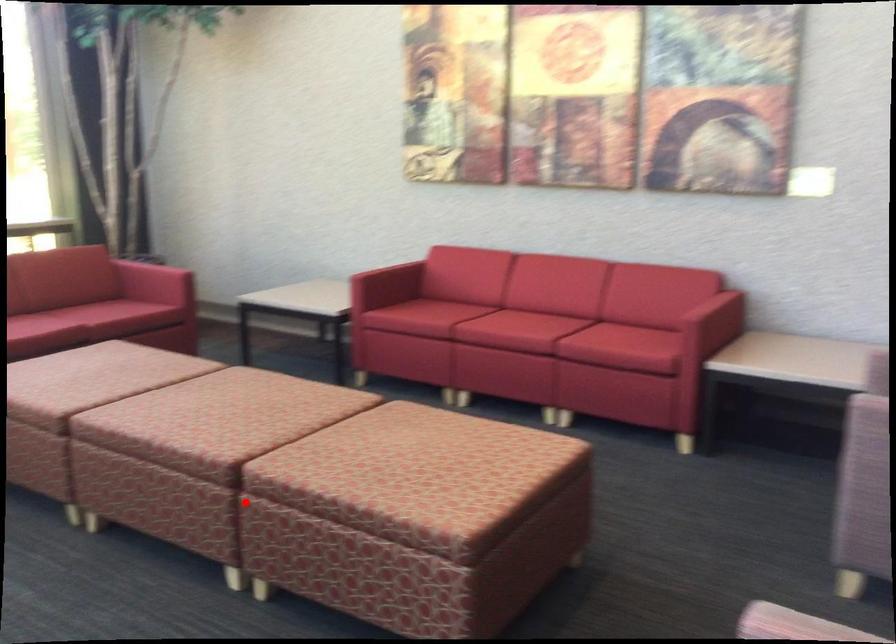
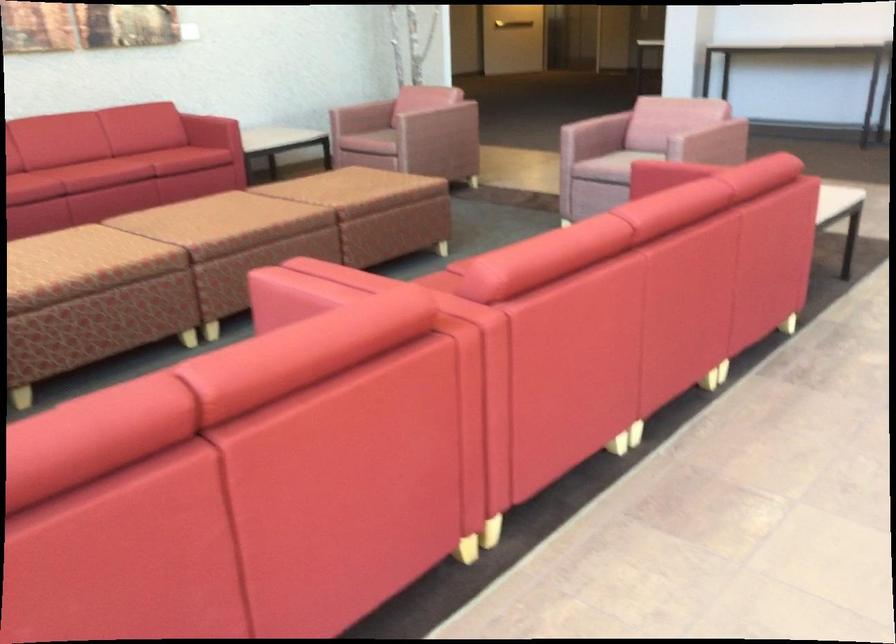
Question: I am providing you with two images of the same scene from different viewpoints. In image1, a red point is highlighted. Considering the same 3D point in image2, which of the following is correct?

Choices:
 (A) It is closer
 (B) It is farther

Answer: (B)